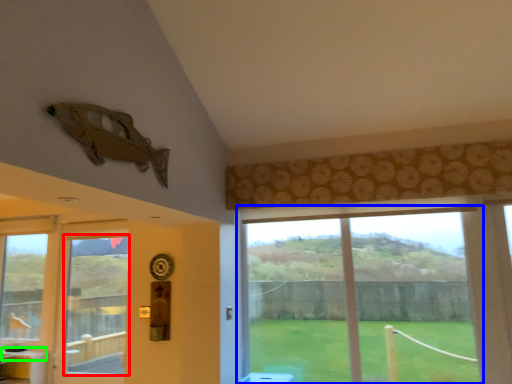
Question: Based on their relative distances, which object is nearer to window screen (highlighted by a red box)? Choose from window (highlighted by a blue box) and counter top (highlighted by a green box).

Choices:
 (A) window
 (B) counter top

Answer: (B)